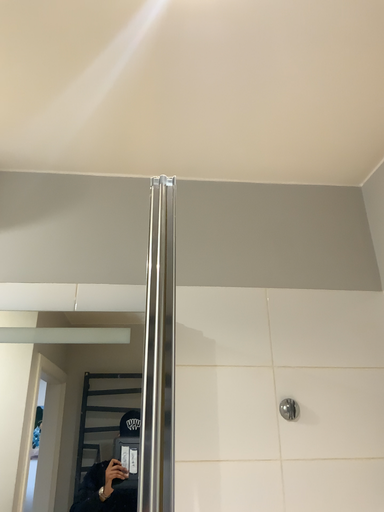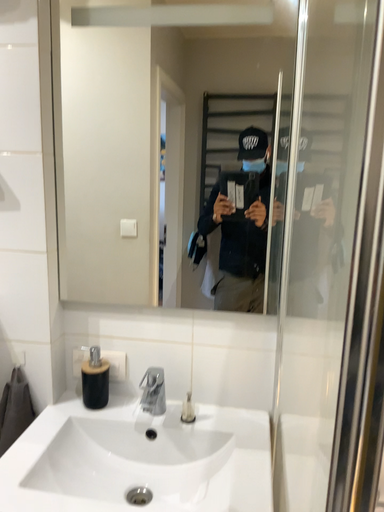
Question: Which way did the camera rotate in the video?

Choices:
 (A) rotated upward
 (B) rotated downward

Answer: (B)